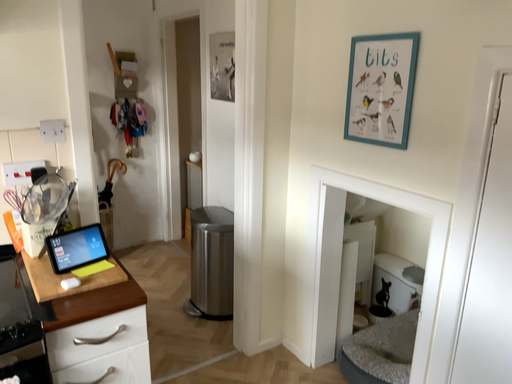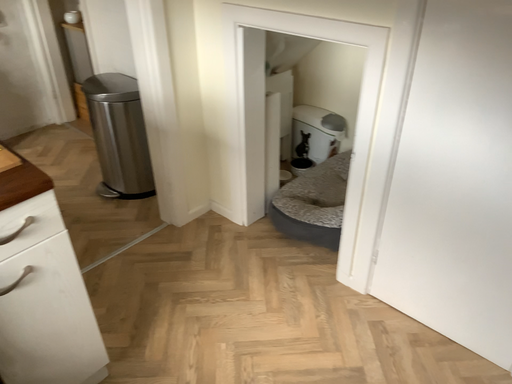
Question: How did the camera likely rotate when shooting the video?

Choices:
 (A) rotated left
 (B) rotated right

Answer: (B)